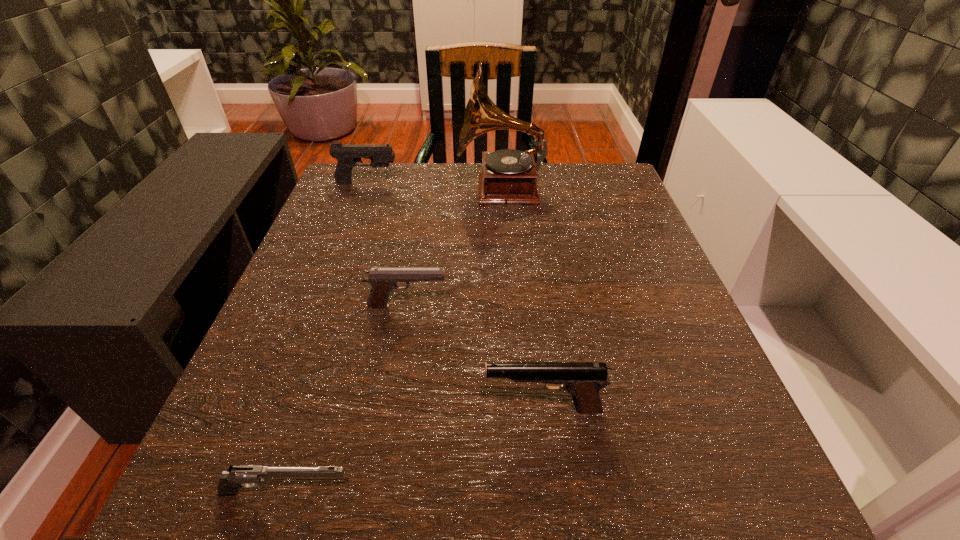
Locate an element on the screen. free spot located on the horn of the tallest object is located at coordinates (413, 190).

Find the location of a particular element. The image size is (960, 540). vacant region located 0.240m at the barrel of the farthest pistol is located at coordinates (495, 183).

You are a GUI agent. You are given a task and a screenshot of the screen. Output one action in this format:
    pyautogui.click(x=<x>, y=<y>)
    Task: Click on the vacant area situated 0.360m at the muzzle of the fourth farthest object
    This screenshot has width=960, height=540.
    Given the screenshot: What is the action you would take?
    pyautogui.click(x=228, y=409)

Locate an element on the screen. The width and height of the screenshot is (960, 540). vacant space located 0.150m at the muzzle of the fourth farthest object is located at coordinates (378, 409).

At what (x,y) coordinates should I click in order to perform the action: click on vacant space situated at the muzzle of the fourth farthest object. Please return your answer as a coordinate pair (x, y). This screenshot has width=960, height=540. Looking at the image, I should click on tap(385, 409).

Where is `vacant space positioned 0.190m at the barrel of the third nearest object`? The image size is (960, 540). vacant space positioned 0.190m at the barrel of the third nearest object is located at coordinates (556, 306).

Image resolution: width=960 pixels, height=540 pixels. What are the coordinates of `free region located 0.110m on the front-facing side of the nearest pistol` in the screenshot? It's located at (444, 493).

Identify the location of phonograph_record that is at the far edge. The height and width of the screenshot is (540, 960). (508, 176).

Find the location of `pistol that is positioned at the far edge`. pistol that is positioned at the far edge is located at coordinates (347, 156).

Where is `object located in the near edge section of the desktop`? This screenshot has height=540, width=960. object located in the near edge section of the desktop is located at coordinates (249, 476).